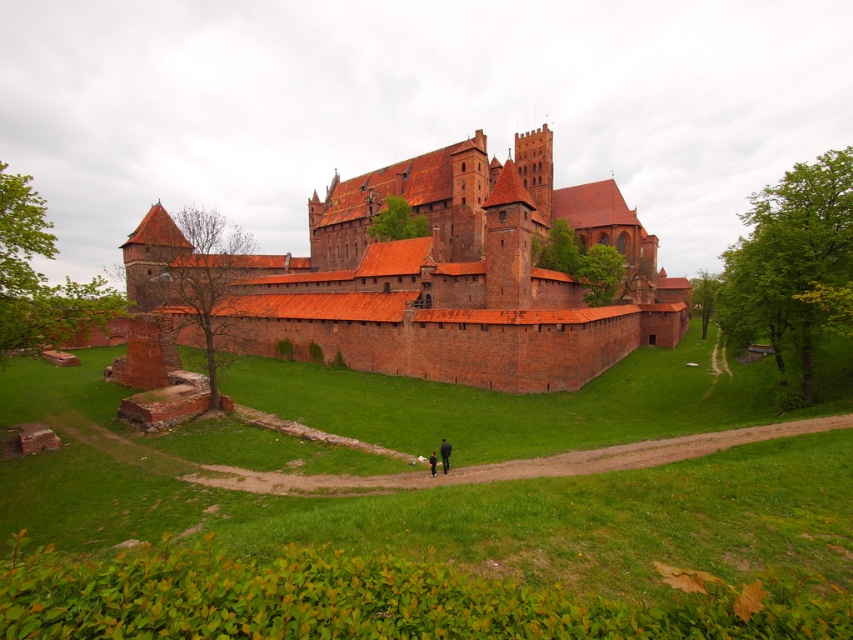
Can you confirm if dark blue jeans at lower center is positioned to the right of black fabric person at lower center?

Yes, dark blue jeans at lower center is to the right of black fabric person at lower center.

This screenshot has width=853, height=640. Describe the element at coordinates (444, 454) in the screenshot. I see `dark blue jeans at lower center` at that location.

Does point (442, 451) come in front of point (434, 460)?

Yes, point (442, 451) is in front of point (434, 460).

This screenshot has width=853, height=640. In order to click on dark blue jeans at lower center in this screenshot , I will do `click(444, 454)`.

Can you confirm if brick wall at center is bigger than dark blue jeans at lower center?

Correct, brick wall at center is larger in size than dark blue jeans at lower center.

Is brick wall at center below dark blue jeans at lower center?

No, brick wall at center is not below dark blue jeans at lower center.

Is point (132, 266) behind point (445, 445)?

That is True.

I want to click on brick wall at center, so click(456, 276).

Is brick wall at center to the left of black fabric person at lower center from the viewer's perspective?

Indeed, brick wall at center is positioned on the left side of black fabric person at lower center.

Looking at this image, is brick wall at center closer to the viewer compared to black fabric person at lower center?

No, brick wall at center is behind black fabric person at lower center.

I want to click on brick wall at center, so click(x=456, y=276).